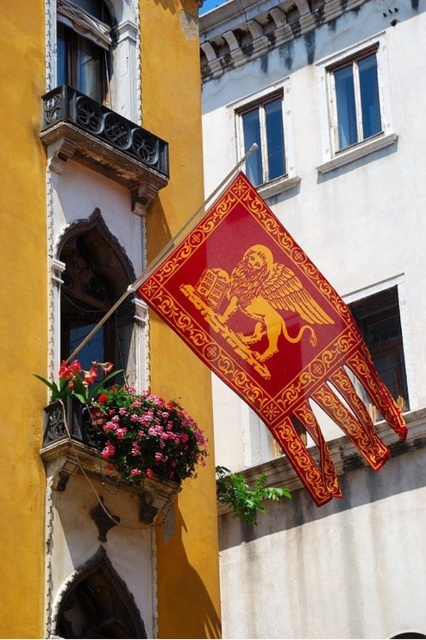
You are standing in the urban scene and want to determine which of the two points, point (294,280) or point (51,413), is closer to you. Based on the scene, which point is nearer?

Point (294,280) is further to the viewer than point (51,413), so the closer point is point (51,413).

You are a photographer trying to capture the shiny red fabric flag at center and the pink fabric flower at lower left in the same frame. Can you see both objects at the same time without moving your camera? Explain your reasoning based on their positions.

The shiny red fabric flag at center is positioned over the pink fabric flower at lower left, so the flag partially or fully blocks the flower from view. Therefore, you might not be able to see both objects clearly in the same frame without moving the camera to adjust the angle or zoom out.

You are a photographer standing at a certain point wanting to capture the shiny red fabric flag at center in your shot. The camera you are using has a maximum focus range of 40 meters. Can you focus on the flag?

The shiny red fabric flag at center is 38.32 meters away from the camera. Since the maximum focus range is 40 meters, the camera can focus on the flag as the distance is within the range.